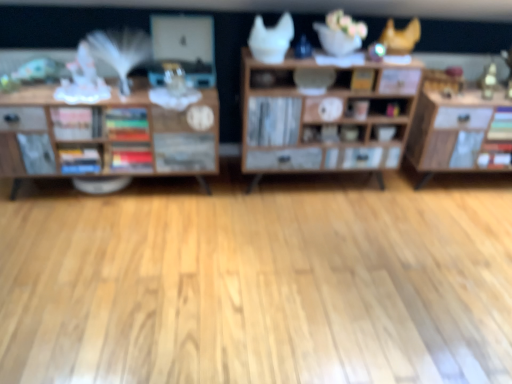
Question: Which direction should I rotate to look at yellow matte book at center, acting as the first book starting from the right?

Choices:
 (A) right
 (B) left

Answer: (A)

Question: Is matte white bowl at center behind multicolored hardcover books at center, the second book from the right?

Choices:
 (A) no
 (B) yes

Answer: (B)

Question: Is matte white bowl at center positioned with its back to multicolored hardcover books at center, which appears as the third book when viewed from the left?

Choices:
 (A) no
 (B) yes

Answer: (A)

Question: Does matte white bowl at center turn towards multicolored hardcover books at center, which appears as the third book when viewed from the left?

Choices:
 (A) no
 (B) yes

Answer: (A)

Question: Does matte white bowl at center come in front of multicolored hardcover books at center, the second book from the right?

Choices:
 (A) no
 (B) yes

Answer: (A)

Question: Does matte white bowl at center have a greater width compared to multicolored hardcover books at center, which appears as the third book when viewed from the left?

Choices:
 (A) no
 (B) yes

Answer: (B)

Question: Considering the relative sizes of matte white bowl at center and multicolored hardcover books at center, which appears as the third book when viewed from the left, in the image provided, is matte white bowl at center smaller than multicolored hardcover books at center, which appears as the third book when viewed from the left,?

Choices:
 (A) yes
 (B) no

Answer: (A)

Question: Is multicolored hardcover books at center, which appears as the third book when viewed from the left, positioned far away from yellow matte book at center, acting as the first book starting from the right?

Choices:
 (A) no
 (B) yes

Answer: (B)

Question: Considering the relative sizes of multicolored hardcover books at center, the second book from the right, and yellow matte book at center, the 4th book when ordered from left to right, in the image provided, is multicolored hardcover books at center, the second book from the right, shorter than yellow matte book at center, the 4th book when ordered from left to right,?

Choices:
 (A) yes
 (B) no

Answer: (B)

Question: Can you confirm if multicolored hardcover books at center, the second book from the right, is wider than yellow matte book at center, acting as the first book starting from the right?

Choices:
 (A) no
 (B) yes

Answer: (B)

Question: From the image's perspective, is multicolored hardcover books at center, which appears as the third book when viewed from the left, on yellow matte book at center, the 4th book when ordered from left to right?

Choices:
 (A) no
 (B) yes

Answer: (A)

Question: Can you confirm if multicolored hardcover books at center, the second book from the right, is smaller than yellow matte book at center, the 4th book when ordered from left to right?

Choices:
 (A) no
 (B) yes

Answer: (A)

Question: Does multicolored hardcover books at center, which appears as the third book when viewed from the left, lie in front of yellow matte book at center, the 4th book when ordered from left to right?

Choices:
 (A) no
 (B) yes

Answer: (B)

Question: Considering the relative positions of wooden cabinet at center, the second shelf when ordered from left to right, and multicolored hardcover books at center, the second book from the right, in the image provided, is wooden cabinet at center, the second shelf when ordered from left to right, to the right of multicolored hardcover books at center, the second book from the right, from the viewer's perspective?

Choices:
 (A) no
 (B) yes

Answer: (B)